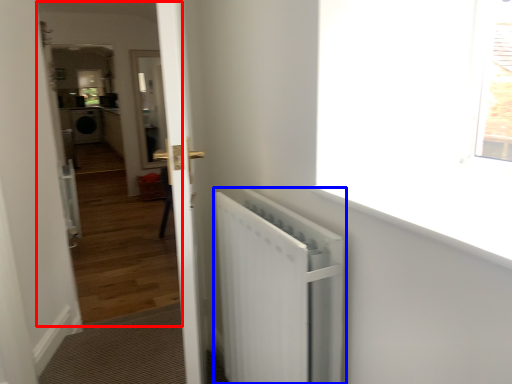
Question: Which object appears closest to the camera in this image, corridor (highlighted by a red box) or radiator (highlighted by a blue box)?

Choices:
 (A) corridor
 (B) radiator

Answer: (B)